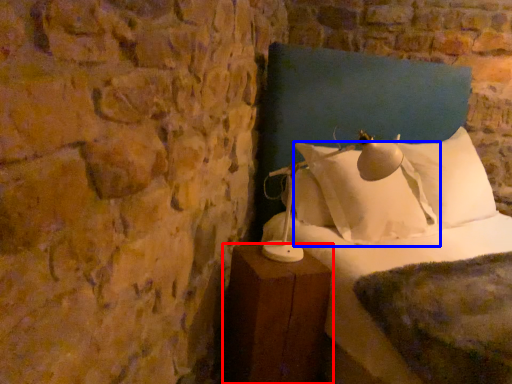
Question: Which object is closer to the camera taking this photo, furniture (highlighted by a red box) or pillow (highlighted by a blue box)?

Choices:
 (A) furniture
 (B) pillow

Answer: (A)